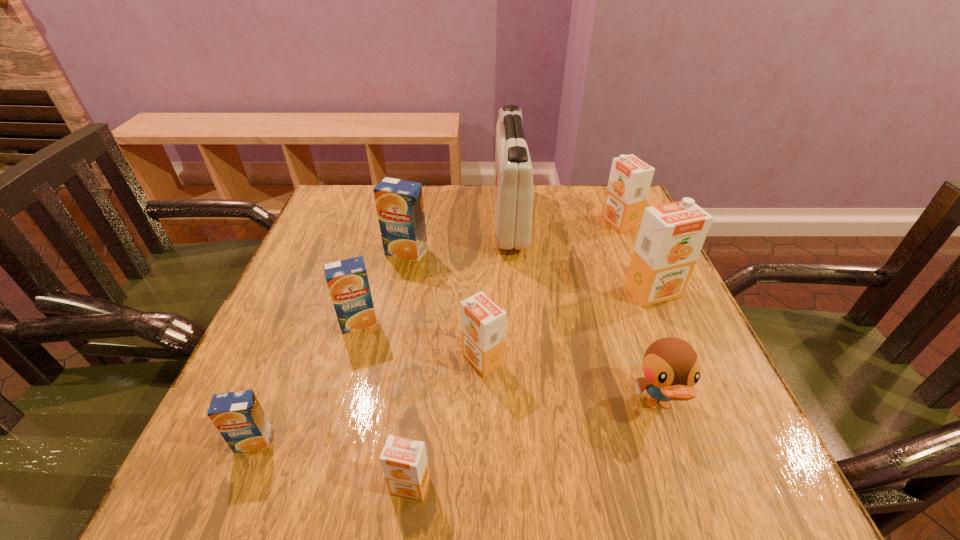
Find the location of a particular element. duck located in the right edge section of the desktop is located at coordinates (671, 367).

Where is `object that is positioned at the near left corner`? This screenshot has width=960, height=540. object that is positioned at the near left corner is located at coordinates (238, 416).

The image size is (960, 540). Find the location of `object that is at the far right corner`. object that is at the far right corner is located at coordinates (630, 178).

This screenshot has height=540, width=960. Identify the location of free space at the far edge. (477, 218).

Locate an element on the screen. The image size is (960, 540). free spot at the near edge of the desktop is located at coordinates (453, 500).

Where is `vacant space at the left edge of the desktop`? The image size is (960, 540). vacant space at the left edge of the desktop is located at coordinates (330, 317).

Find the location of a particular element. The width and height of the screenshot is (960, 540). free region at the right edge of the desktop is located at coordinates (635, 241).

Locate an element on the screen. This screenshot has width=960, height=540. free space between the sixth nearest object and the leftmost object is located at coordinates (453, 366).

Locate an element on the screen. The height and width of the screenshot is (540, 960). vacant region between the farthest orange juice and the duck is located at coordinates (638, 313).

This screenshot has width=960, height=540. What are the coordinates of `free space between the first-aid kit and the fourth nearest object` in the screenshot? It's located at (496, 289).